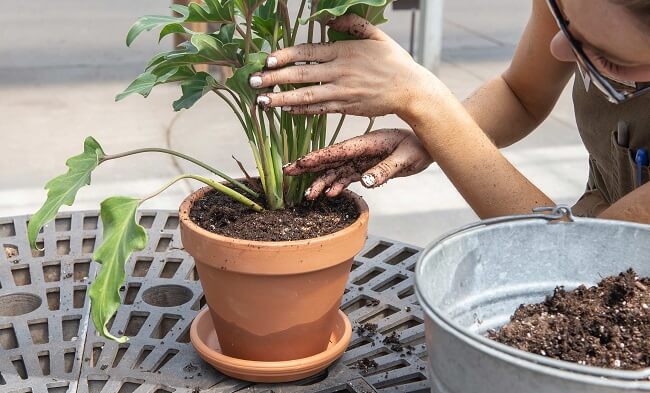
Find the location of `ceramic plant pot`. ceramic plant pot is located at coordinates 274,294.